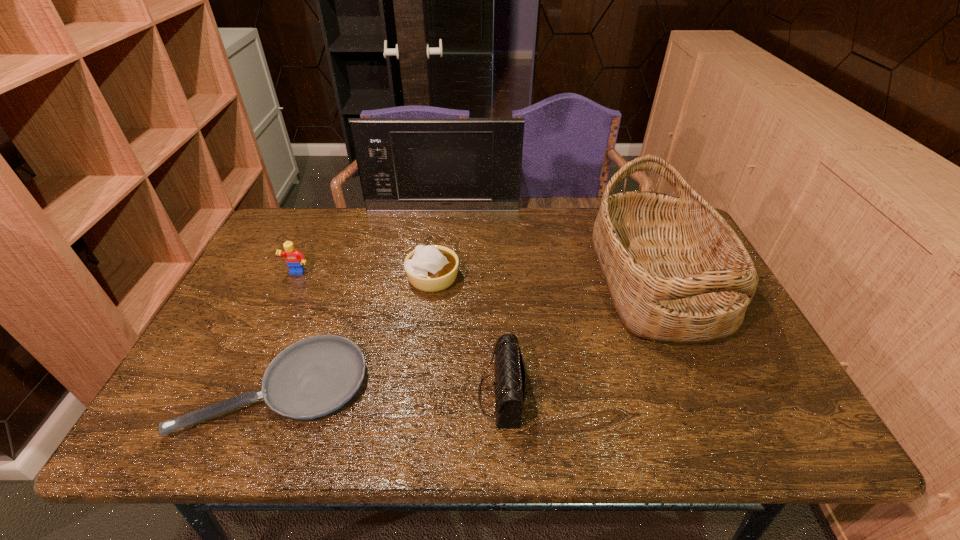
Locate an element on the screen. The height and width of the screenshot is (540, 960). blank space located on the left of the whipped cream is located at coordinates (303, 279).

This screenshot has width=960, height=540. Find the location of `free space located on the face of the Lego`. free space located on the face of the Lego is located at coordinates (254, 367).

The image size is (960, 540). In order to click on vacant area situated on the front flap of the clutch bag in this screenshot , I will do `click(328, 395)`.

Where is `vacant space situated on the front flap of the clutch bag`? Image resolution: width=960 pixels, height=540 pixels. vacant space situated on the front flap of the clutch bag is located at coordinates pos(405,395).

In order to click on free space located 0.300m on the front flap of the clutch bag in this screenshot , I will do `click(342, 395)`.

Identify the location of vacant space situated 0.080m on the right of the shortest object. (401, 388).

Where is `microwave oven that is at the far edge`? The height and width of the screenshot is (540, 960). microwave oven that is at the far edge is located at coordinates (405, 164).

What are the coordinates of `basket that is positioned at the far edge` in the screenshot? It's located at (676, 271).

The width and height of the screenshot is (960, 540). I want to click on clutch bag that is at the near edge, so click(510, 381).

Locate an element on the screen. The width and height of the screenshot is (960, 540). frying pan located in the near edge section of the desktop is located at coordinates (313, 377).